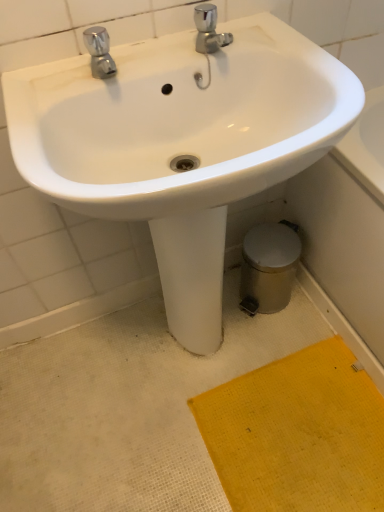
Question: Would you say yellow textured mat at lower right is part of white glossy sink at center's contents?

Choices:
 (A) yes
 (B) no

Answer: (B)

Question: Considering the relative positions of white glossy sink at center and yellow textured mat at lower right in the image provided, is white glossy sink at center in front of yellow textured mat at lower right?

Choices:
 (A) no
 (B) yes

Answer: (B)

Question: Are white glossy sink at center and yellow textured mat at lower right far apart?

Choices:
 (A) no
 (B) yes

Answer: (A)

Question: From the image's perspective, is white glossy sink at center over yellow textured mat at lower right?

Choices:
 (A) no
 (B) yes

Answer: (B)

Question: Can you confirm if white glossy sink at center is taller than yellow textured mat at lower right?

Choices:
 (A) yes
 (B) no

Answer: (A)

Question: Looking at their shapes, would you say yellow textured mat at lower right is wider or thinner than white glossy sink at center?

Choices:
 (A) wide
 (B) thin

Answer: (A)

Question: From the image's perspective, is yellow textured mat at lower right positioned above or below white glossy sink at center?

Choices:
 (A) above
 (B) below

Answer: (B)

Question: Is yellow textured mat at lower right in front of or behind white glossy sink at center in the image?

Choices:
 (A) front
 (B) behind

Answer: (B)

Question: Is yellow textured mat at lower right taller or shorter than white glossy sink at center?

Choices:
 (A) tall
 (B) short

Answer: (B)

Question: In terms of size, does polished chrome faucet at upper left appear bigger or smaller than white glossy sink at center?

Choices:
 (A) big
 (B) small

Answer: (B)

Question: From a real-world perspective, is polished chrome faucet at upper left above or below white glossy sink at center?

Choices:
 (A) above
 (B) below

Answer: (A)

Question: Based on their positions, is polished chrome faucet at upper left located to the left or right of white glossy sink at center?

Choices:
 (A) right
 (B) left

Answer: (B)

Question: Do you think polished chrome faucet at upper left is within white glossy sink at center, or outside of it?

Choices:
 (A) inside
 (B) outside

Answer: (B)

Question: Is polished chrome faucet at upper left inside or outside of yellow textured mat at lower right?

Choices:
 (A) inside
 (B) outside

Answer: (B)

Question: In the image, is polished chrome faucet at upper left on the left side or the right side of yellow textured mat at lower right?

Choices:
 (A) left
 (B) right

Answer: (A)